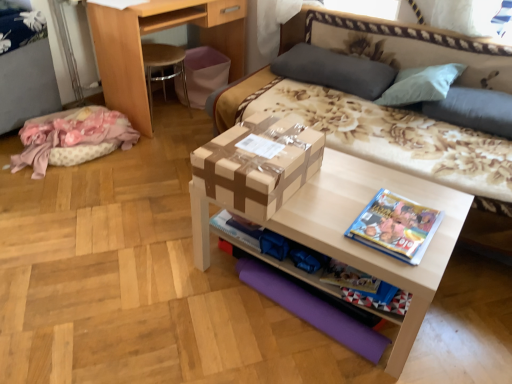
This screenshot has height=384, width=512. Identify the location of vacant space in between pink fabric at left and matte cardboard box at center. (136, 197).